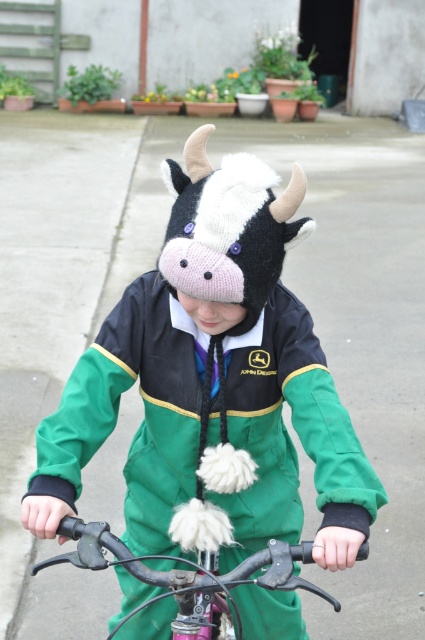
Question: Is knitted woolen hat at center wider than metallic silver bicycle handlebars at center?

Choices:
 (A) no
 (B) yes

Answer: (B)

Question: Which point is farther to the camera?

Choices:
 (A) metallic silver bicycle handlebars at center
 (B) knitted woolen hat at center

Answer: (B)

Question: Which point is closer to the camera?

Choices:
 (A) metallic silver bicycle handlebars at center
 (B) knitted woolen hat at center

Answer: (A)

Question: Can you confirm if knitted woolen hat at center is smaller than metallic silver bicycle handlebars at center?

Choices:
 (A) no
 (B) yes

Answer: (A)

Question: Is knitted woolen hat at center to the right of metallic silver bicycle handlebars at center from the viewer's perspective?

Choices:
 (A) no
 (B) yes

Answer: (B)